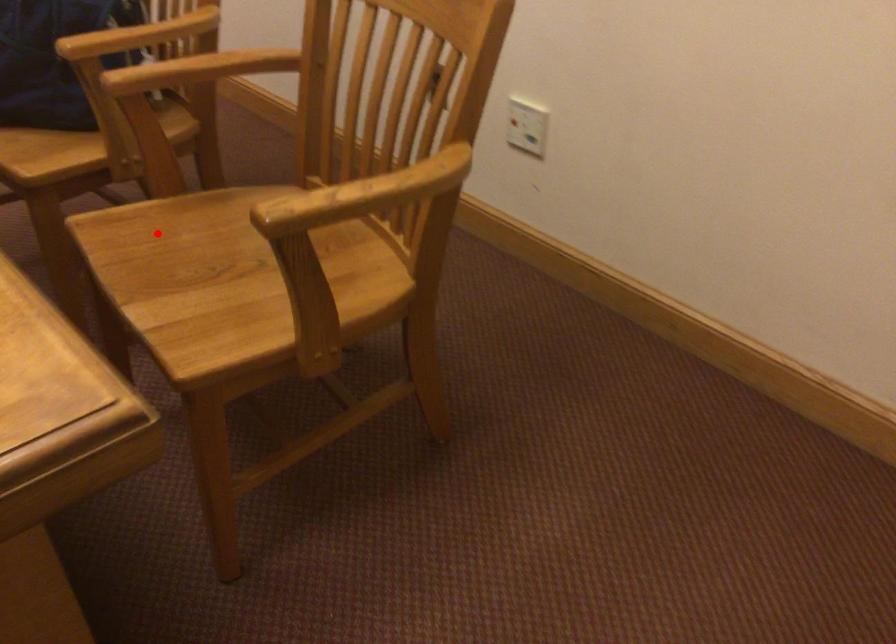
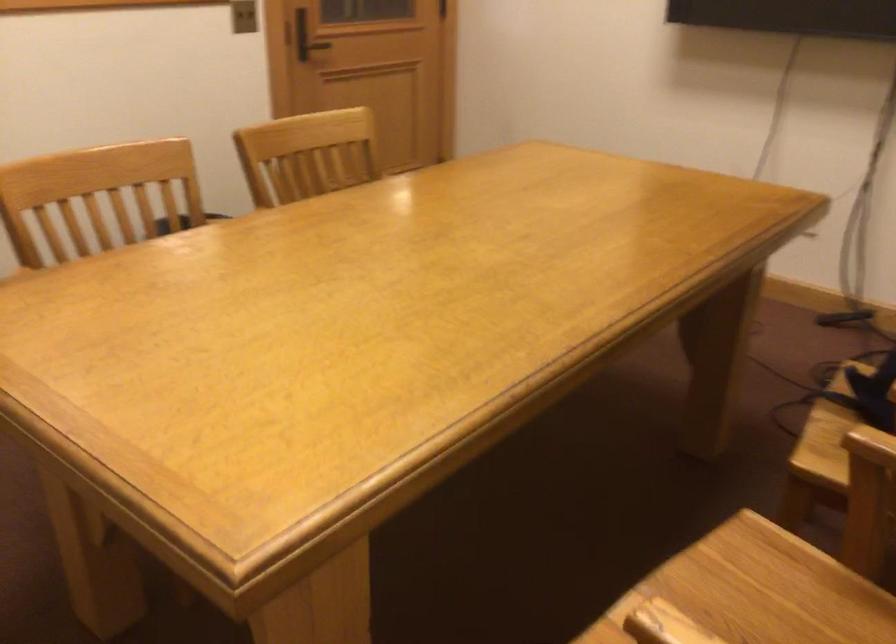
Find the pixel in the second image that matches the highlighted location in the first image.

(764, 588)